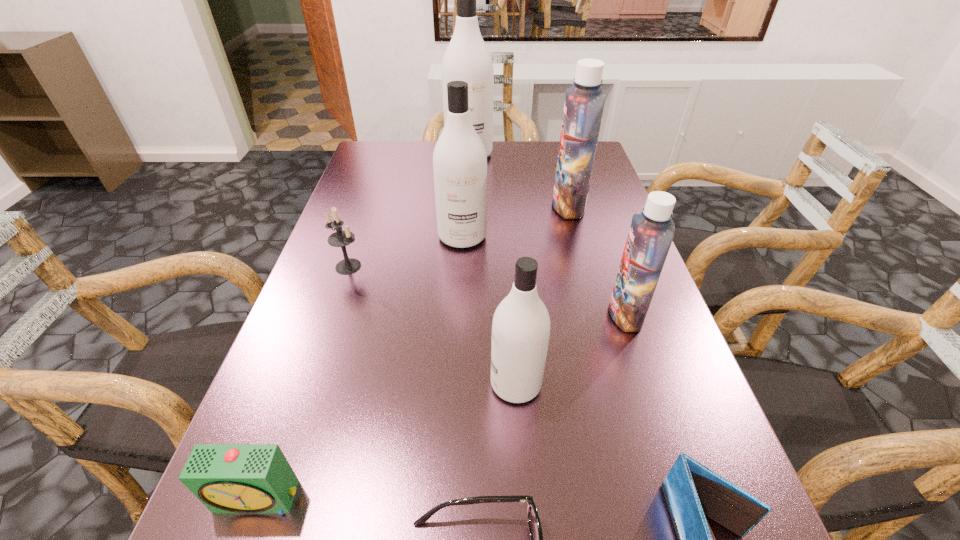
You are a GUI agent. You are given a task and a screenshot of the screen. Output one action in this format:
    pyautogui.click(x=<x>, y=<y>)
    Task: Click on the green alarm clock
    The width and height of the screenshot is (960, 540).
    Given the screenshot: What is the action you would take?
    pyautogui.click(x=227, y=478)

You are a GUI agent. You are given a task and a screenshot of the screen. Output one action in this format:
    pyautogui.click(x=<x>, y=<y>)
    Task: Click on the vacant region located 0.340m on the front-facing side of the tallest object
    
    Given the screenshot: What is the action you would take?
    pyautogui.click(x=466, y=232)

Identify the location of vacant position located on the front label of the farther blue shampoo. This screenshot has height=540, width=960. (503, 206).

The height and width of the screenshot is (540, 960). In order to click on vacant area situated 0.110m on the front label of the farther blue shampoo in this screenshot , I will do `click(511, 206)`.

Where is `vacant space located on the front label of the farther blue shampoo`? The width and height of the screenshot is (960, 540). vacant space located on the front label of the farther blue shampoo is located at coordinates (492, 206).

Find the location of a particular element. free space located on the front-facing side of the second smallest white shampoo is located at coordinates (458, 333).

The image size is (960, 540). I want to click on free space located on the front label of the nearer blue shampoo, so click(x=409, y=314).

Where is `vacant area situated on the front label of the nearer blue shampoo`? The height and width of the screenshot is (540, 960). vacant area situated on the front label of the nearer blue shampoo is located at coordinates (428, 314).

Where is `vacant region located on the front label of the nearer blue shampoo`? This screenshot has width=960, height=540. vacant region located on the front label of the nearer blue shampoo is located at coordinates (439, 314).

I want to click on vacant region located 0.240m on the front-facing side of the fourth nearest object, so click(350, 384).